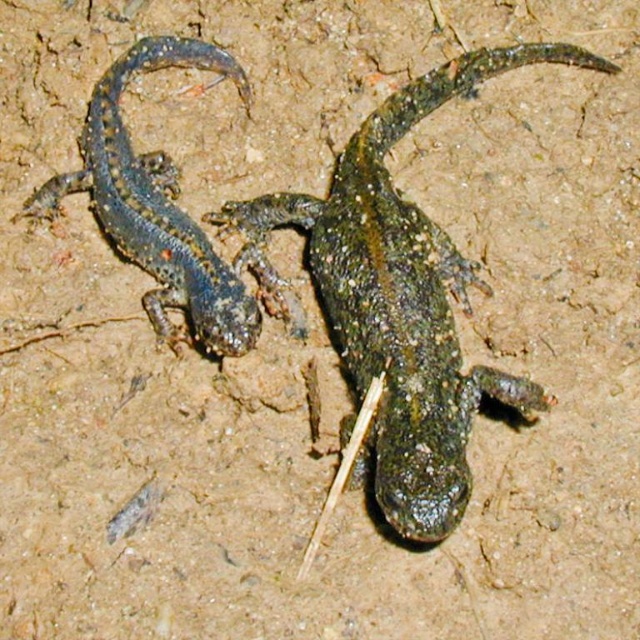
You are a photographer trying to capture a closeup shot of the green scaly lizard at center. Your camera can focus on objects within 1 meter. Will you need to move closer or farther away to get a clear shot?

The green scaly lizard at center is 1.13 meters from the camera, which is beyond the 1 meter focus range. To get a clear shot, you need to move closer to reduce the distance to within 1 meter.

You are a small insect observing the green scaly lizard at center and the shiny blue lizard at left. Which lizard do you see as taller from your perspective?

The green scaly lizard at center is much taller than the shiny blue lizard at left, so from your perspective as a small insect, you would see the green scaly lizard at center as taller.

In the scene shown: You are a researcher observing the lizards in their habitat. You need to determine which lizard has a greater body width between the green scaly lizard at center and the shiny blue lizard at left. Which one is wider?

The green scaly lizard at center has a greater body width than the shiny blue lizard at left according to the description provided.